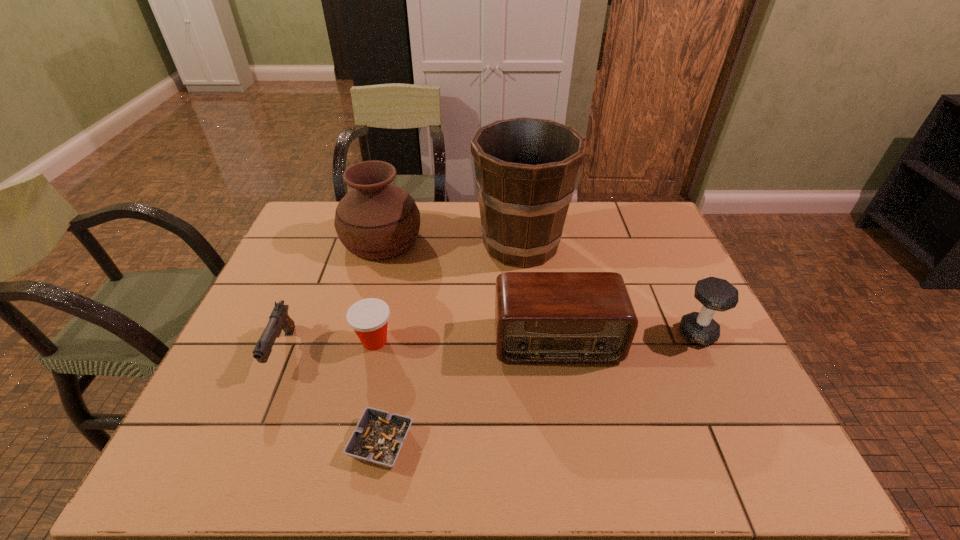
This screenshot has width=960, height=540. I want to click on bucket, so click(x=526, y=168).

This screenshot has width=960, height=540. Identify the location of urn. (376, 219).

Image resolution: width=960 pixels, height=540 pixels. I want to click on radio receiver, so click(540, 317).

Find the location of `dumbbell`. dumbbell is located at coordinates (715, 294).

Identify the location of the leftmost object. (279, 319).

You are a GUI agent. You are given a task and a screenshot of the screen. Output one action in this format:
    pyautogui.click(x=<x>, y=<y>)
    Task: Click on the Dixie cup
    Image resolution: width=960 pixels, height=540 pixels.
    Given the screenshot: What is the action you would take?
    pyautogui.click(x=368, y=317)

Find the location of a particular element. Image resolution: width=960 pixels, height=540 pixels. ashtray is located at coordinates point(379,436).

Identify the location of the shortest object. Image resolution: width=960 pixels, height=540 pixels. (379, 436).

Identify the location of vacant space situated on the front of the tallest object. This screenshot has height=540, width=960. (533, 356).

Identify the location of free region located 0.060m on the back of the second tallest object. This screenshot has width=960, height=540. (391, 207).